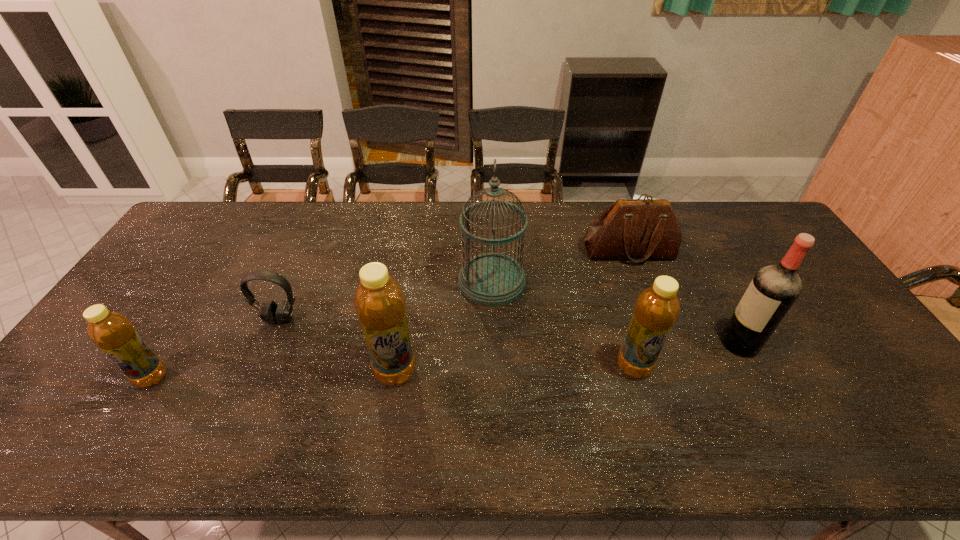
Considering the uniform spacing of bottles, where should an additional bottle be positioned on the right? Please locate a free spot. Please provide its 2D coordinates. Your answer should be formatted as a tuple, i.e. [(x, y)], where the tuple contains the x and y coordinates of a point satisfying the conditions above.

[(867, 361)]